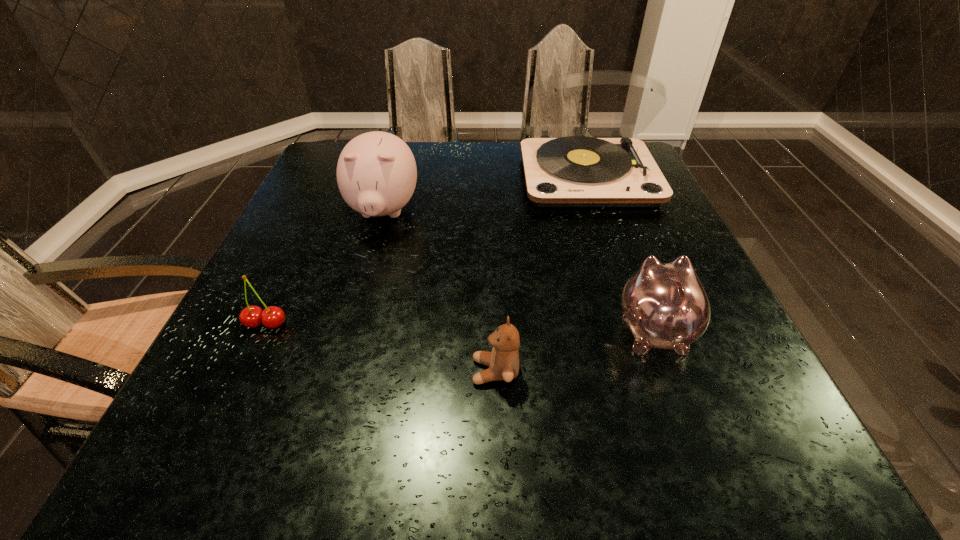
Where is `vacant region located on the front facing side of the nearer piggy bank`? Image resolution: width=960 pixels, height=540 pixels. vacant region located on the front facing side of the nearer piggy bank is located at coordinates (632, 271).

Image resolution: width=960 pixels, height=540 pixels. Find the location of `free space located on the front facing side of the nearer piggy bank`. free space located on the front facing side of the nearer piggy bank is located at coordinates (621, 244).

Where is `vacant space located on the front-facing side of the third object from right to left`? The image size is (960, 540). vacant space located on the front-facing side of the third object from right to left is located at coordinates (348, 372).

I want to click on vacant space situated 0.080m on the front-facing side of the third object from right to left, so click(x=425, y=372).

Image resolution: width=960 pixels, height=540 pixels. Find the location of `free region located on the front-facing side of the third object from right to left`. free region located on the front-facing side of the third object from right to left is located at coordinates (319, 372).

Find the location of a particular element. This screenshot has width=960, height=540. vacant area located 0.180m with the stems of the leftmost object pointing upwards is located at coordinates (220, 423).

Where is `object that is at the far edge`? This screenshot has height=540, width=960. object that is at the far edge is located at coordinates (576, 171).

Find the location of `piggy bank situated at the left edge`. piggy bank situated at the left edge is located at coordinates (376, 172).

Identify the location of cherry that is positioned at the left edge. The height and width of the screenshot is (540, 960). (272, 317).

I want to click on record player positioned at the right edge, so click(x=576, y=171).